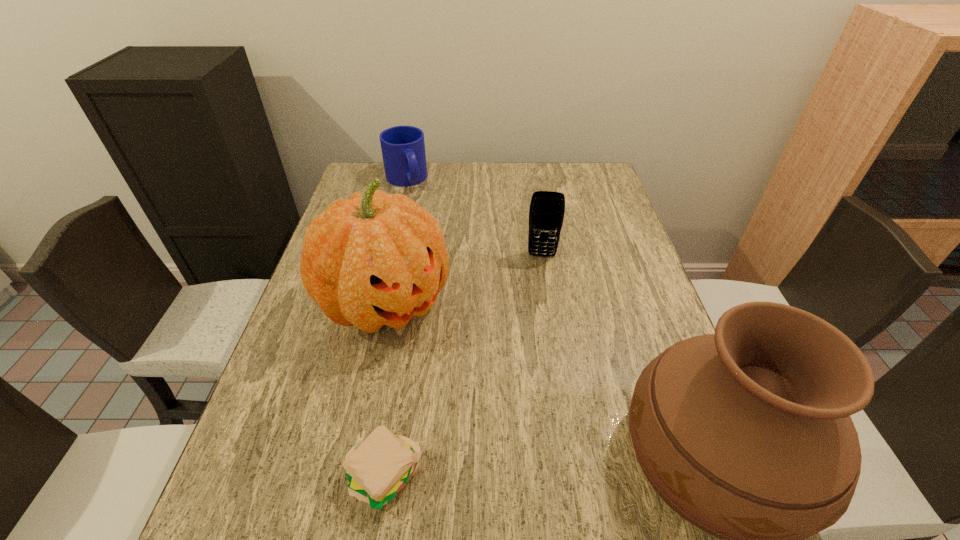
The width and height of the screenshot is (960, 540). I want to click on object positioned at the far left corner, so click(403, 148).

The image size is (960, 540). Identify the location of vacant space at the far edge of the desktop. (521, 164).

Find the location of a particular element. Image resolution: width=960 pixels, height=540 pixels. free spot at the left edge of the desktop is located at coordinates (342, 327).

This screenshot has width=960, height=540. I want to click on vacant area at the right edge of the desktop, so click(x=595, y=239).

The image size is (960, 540). What are the coordinates of `free space at the far left corner` in the screenshot? It's located at (389, 190).

The width and height of the screenshot is (960, 540). Find the location of `free space at the near left corner`. free space at the near left corner is located at coordinates (316, 480).

In order to click on empty location between the patty and the cellular telephone in this screenshot , I will do `click(463, 366)`.

Image resolution: width=960 pixels, height=540 pixels. Find the location of `vacant space in between the shortest object and the cellular telephone`. vacant space in between the shortest object and the cellular telephone is located at coordinates (463, 366).

At what (x,y) coordinates should I click in order to perform the action: click on empty space that is in between the cellular telephone and the fourth tallest object. Please return your answer as a coordinate pair (x, y). Looking at the image, I should click on (474, 218).

The image size is (960, 540). Identify the location of blank region between the cellular telephone and the farthest object. (474, 218).